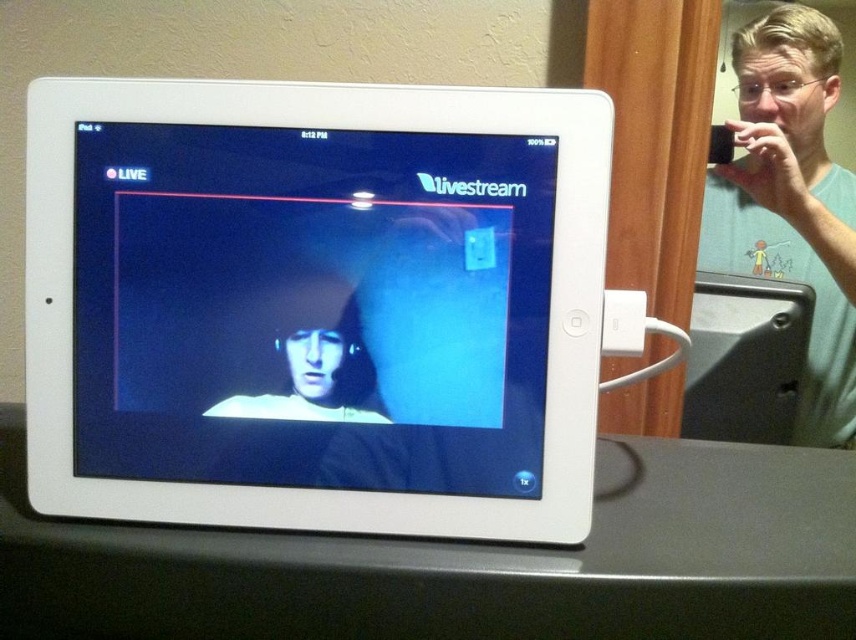
Question: Can you confirm if green matte phone at upper right is positioned to the right of matte black hoodie at center?

Choices:
 (A) no
 (B) yes

Answer: (B)

Question: Is matte black screen at center below green matte phone at upper right?

Choices:
 (A) yes
 (B) no

Answer: (A)

Question: Which point appears closest to the camera in this image?

Choices:
 (A) (266, 412)
 (B) (774, 120)
 (C) (96, 262)

Answer: (C)

Question: Which object is positioned farthest from the matte black screen at center?

Choices:
 (A) green matte phone at upper right
 (B) matte black hoodie at center

Answer: (A)

Question: Does matte black screen at center lie behind green matte phone at upper right?

Choices:
 (A) yes
 (B) no

Answer: (B)

Question: Which of these objects is positioned closest to the matte black hoodie at center?

Choices:
 (A) green matte phone at upper right
 (B) matte black screen at center

Answer: (B)